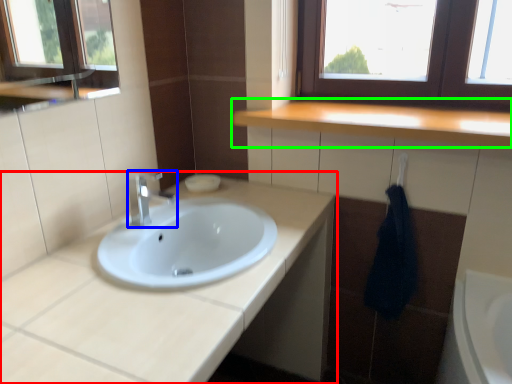
Question: Which object is the farthest from bathroom cabinet (highlighted by a red box)? Choose among these: tap (highlighted by a blue box) or countertop (highlighted by a green box).

Choices:
 (A) tap
 (B) countertop

Answer: (B)